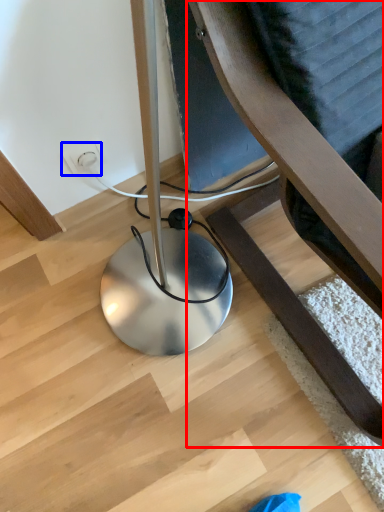
Question: Which object appears farthest to the camera in this image, furniture (highlighted by a red box) or electric outlet (highlighted by a blue box)?

Choices:
 (A) furniture
 (B) electric outlet

Answer: (B)